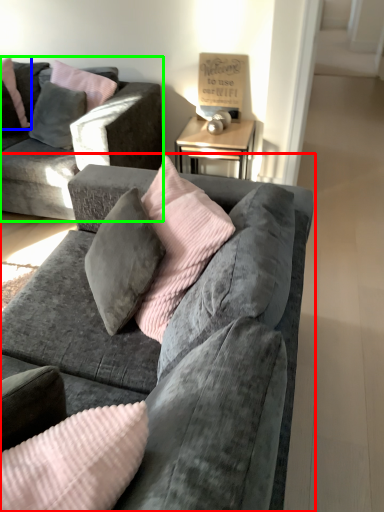
Question: Which is farther away from studio couch (highlighted by a red box)? pillow (highlighted by a blue box) or studio couch (highlighted by a green box)?

Choices:
 (A) pillow
 (B) studio couch

Answer: (A)